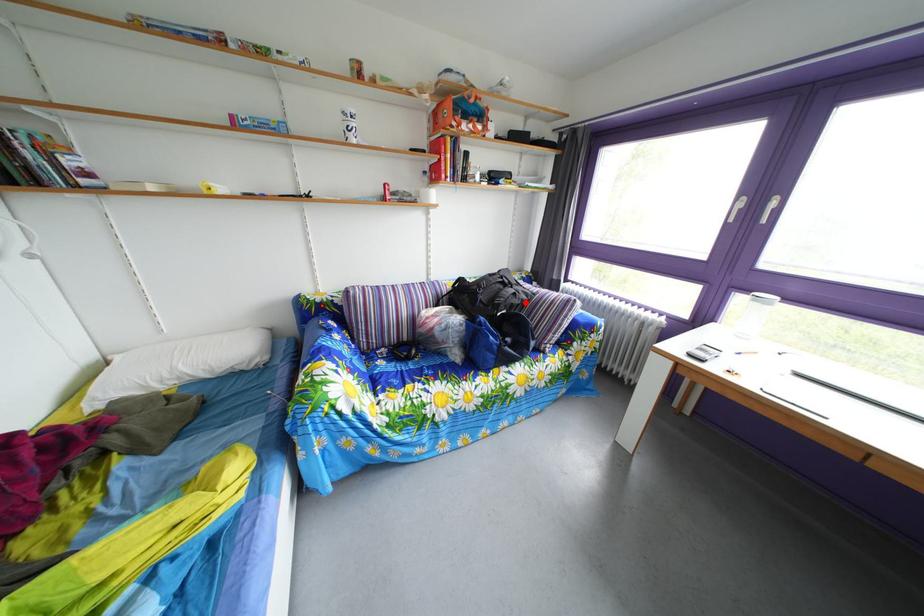
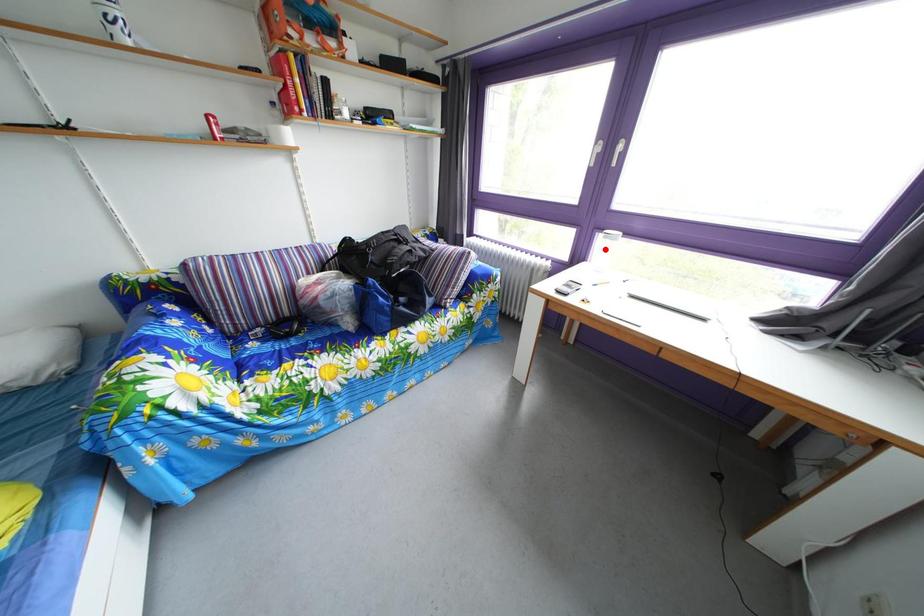
I am providing you with two images of the same scene from different viewpoints. A red point is marked on the first image and another point is marked on the second image. Are the points marked in image1 and image2 representing the same 3D position?

No